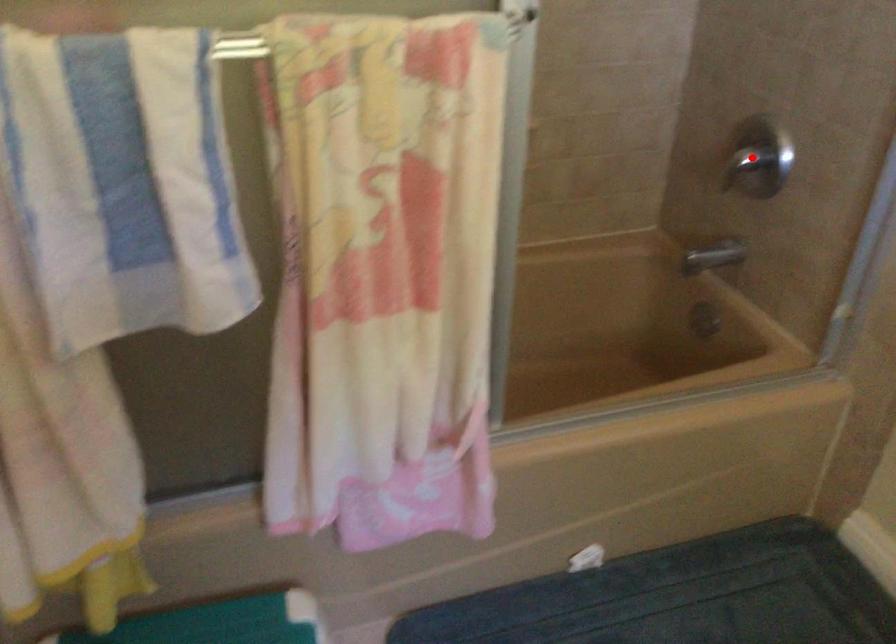
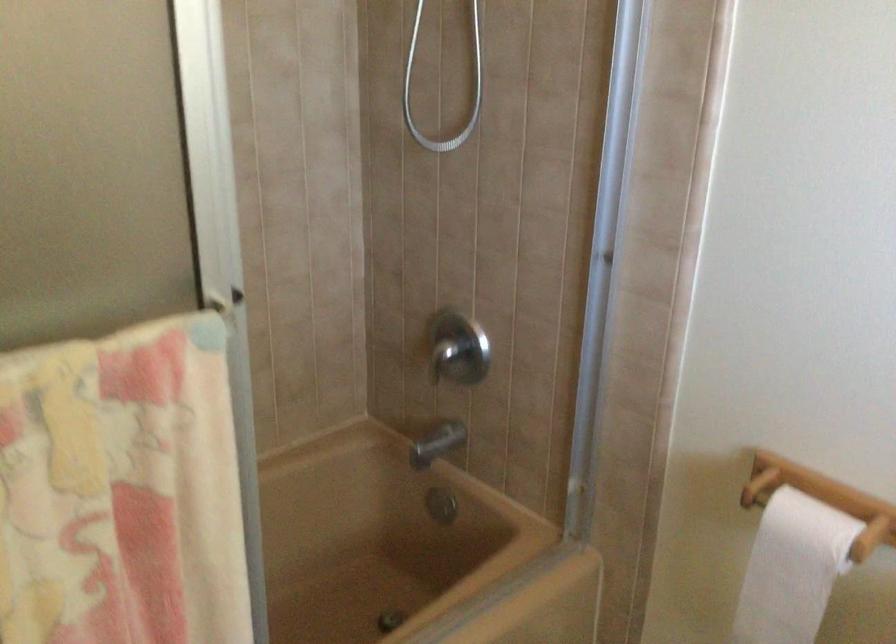
Locate, in the second image, the point that corresponds to the highlighted location in the first image.

(458, 348)